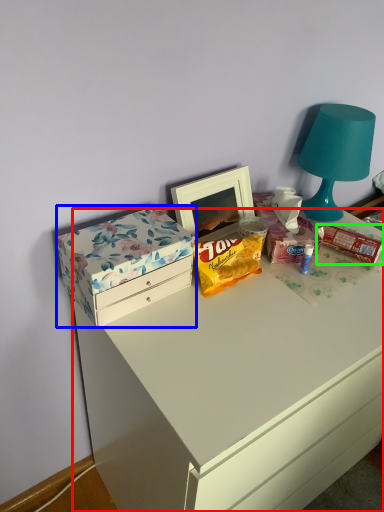
Question: Which object is the closest to the desk (highlighted by a red box)? Choose among these: box (highlighted by a blue box) or snack (highlighted by a green box).

Choices:
 (A) box
 (B) snack

Answer: (A)